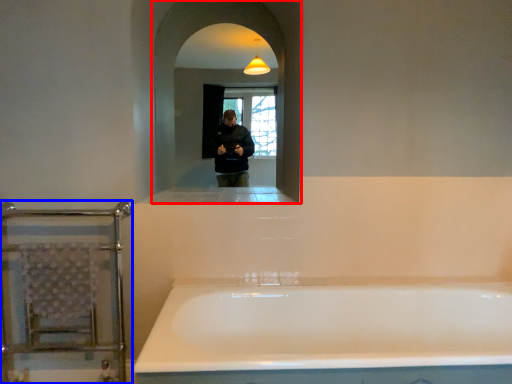
Question: Which of the following is the farthest to the observer, mirror (highlighted by a red box) or balustrade (highlighted by a blue box)?

Choices:
 (A) mirror
 (B) balustrade

Answer: (A)